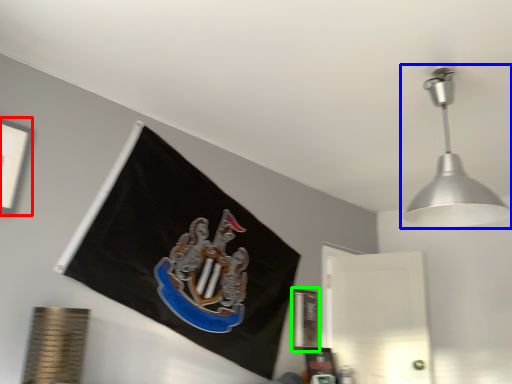
Question: Which object is positioned closest to picture frame (highlighted by a red box)? Select from lamp (highlighted by a blue box) and picture frame (highlighted by a green box).

Choices:
 (A) lamp
 (B) picture frame

Answer: (A)